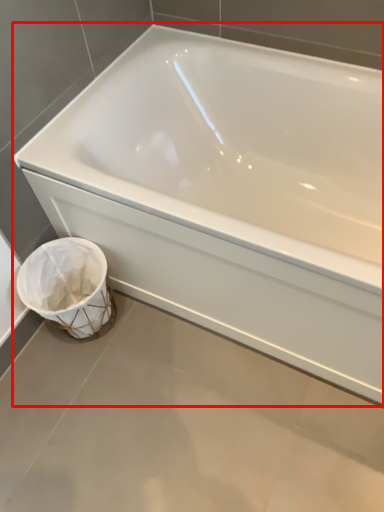
Question: From the image's perspective, considering the relative positions of bathtub (annotated by the red box) and toilet bowl in the image provided, where is bathtub (annotated by the red box) located with respect to the staircase?

Choices:
 (A) below
 (B) above

Answer: (B)